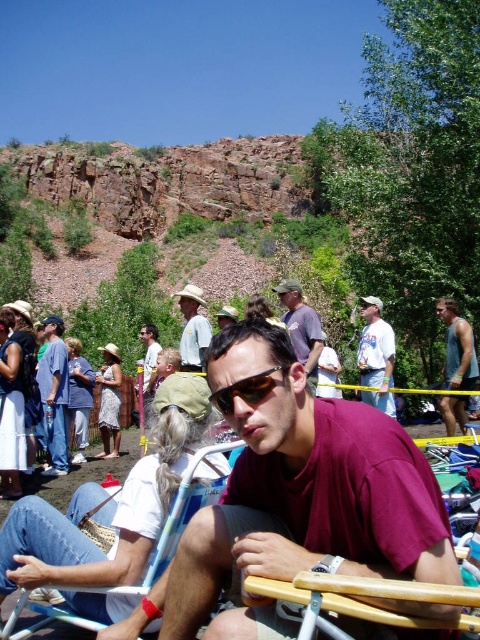
Question: Can you confirm if green tank top at right is positioned to the right of light gray cotton shirt at center?

Choices:
 (A) yes
 (B) no

Answer: (A)

Question: Which point is farther from the camera taking this photo?

Choices:
 (A) (452, 408)
 (B) (233, 308)

Answer: (B)

Question: Is blue plastic beach chair at lower left positioned behind matte gray shirt at center?

Choices:
 (A) yes
 (B) no

Answer: (B)

Question: Which of these objects is positioned closest to the matte brown hat at center?

Choices:
 (A) maroon fabric shirt at center
 (B) blue plastic beach chair at lower left
 (C) matte blue jeans at center

Answer: (C)

Question: Does blue plastic beach chair at lower left have a greater width compared to matte gray shirt at center?

Choices:
 (A) yes
 (B) no

Answer: (A)

Question: Which object is closer to the camera taking this photo?

Choices:
 (A) light gray cotton shirt at center
 (B) matte gray shirt at center
 (C) matte blue jeans at center

Answer: (B)